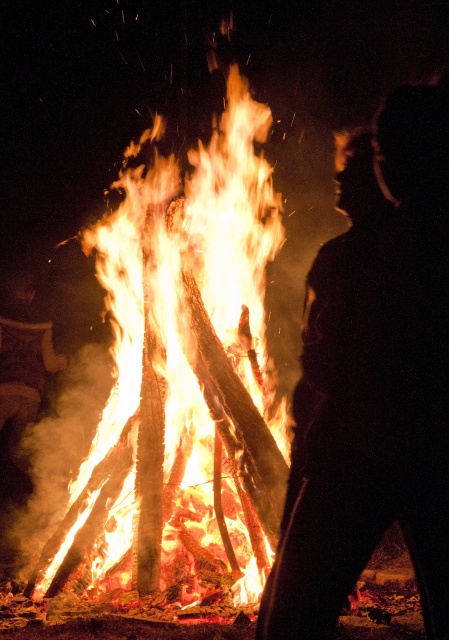
You are standing in the scene and want to move from the point at coordinates point (382, 138) to the point at coordinates point (198, 536). Which direction should you move to get closer to the latter?

To move from point (382, 138) to point (198, 536), you should move towards the right and upward because point (198, 536) is located to the right and above point (382, 138).

You are standing near the bonfire and want to move closer to the silhouette figure at center without getting too close to the bright orange wood at center. Based on their positions, which direction should you move?

The silhouette figure at center is positioned under the bright orange wood at center. To move closer to the silhouette figure at center while avoiding the bright orange wood at center, you should move downward from the bright orange wood at center towards the silhouette figure at center.